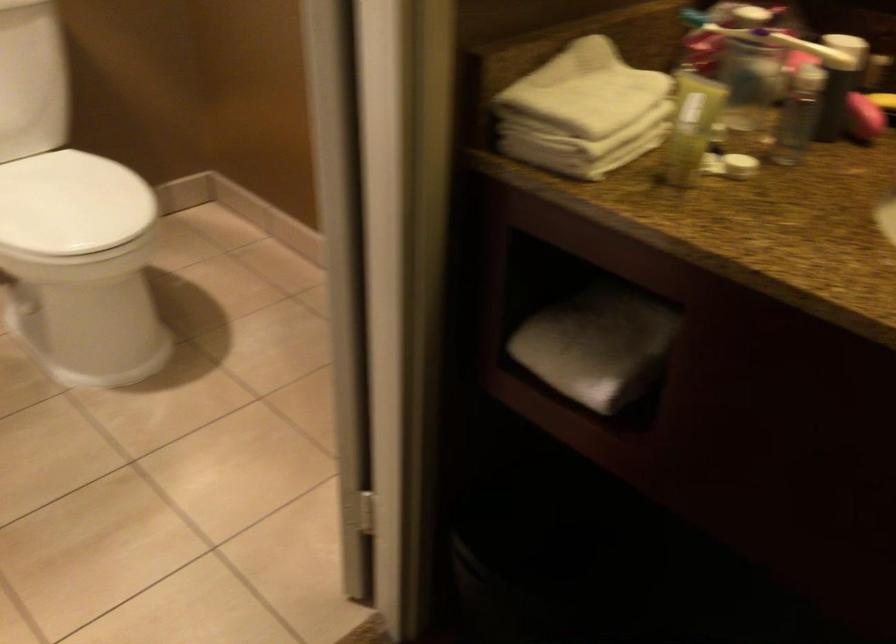
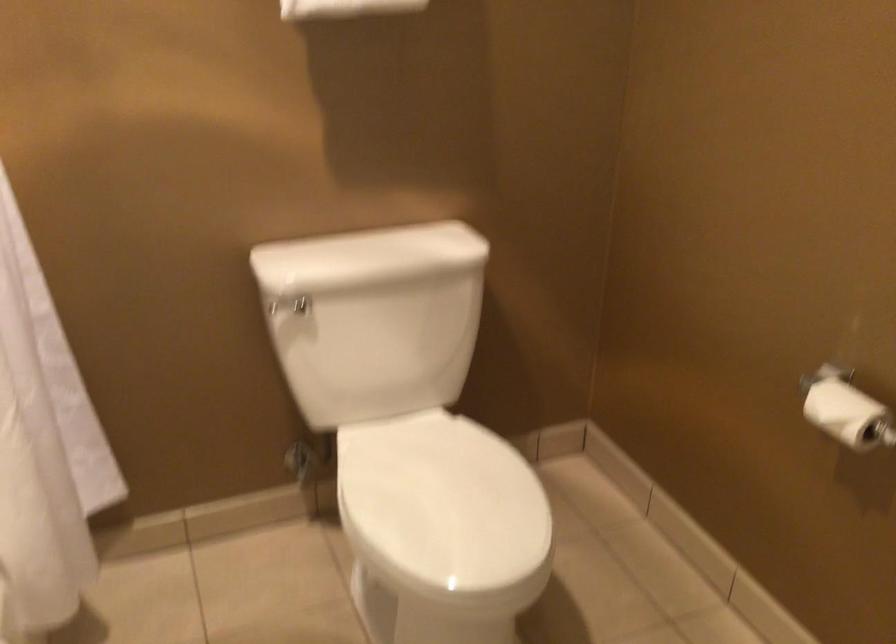
From the picture: What movement of the cameraman would produce the second image?

The movement direction of the cameraman is left, forward.